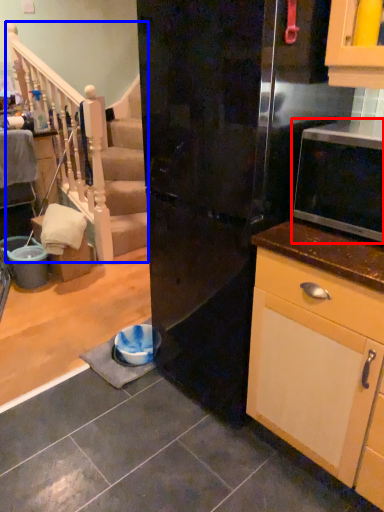
Question: Which object is closer to the camera taking this photo, microwave oven (highlighted by a red box) or rail (highlighted by a blue box)?

Choices:
 (A) microwave oven
 (B) rail

Answer: (A)